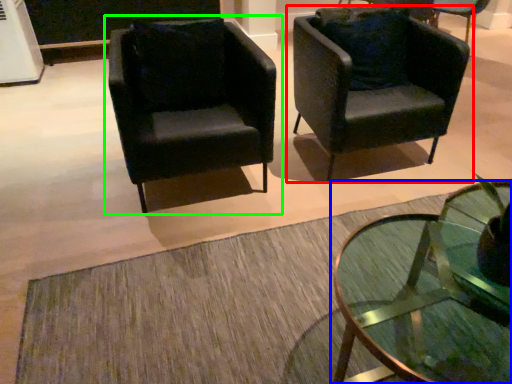
Question: Based on their relative distances, which object is farther from chair (highlighted by a red box)? Choose from coffee table (highlighted by a blue box) and chair (highlighted by a green box).

Choices:
 (A) coffee table
 (B) chair

Answer: (A)